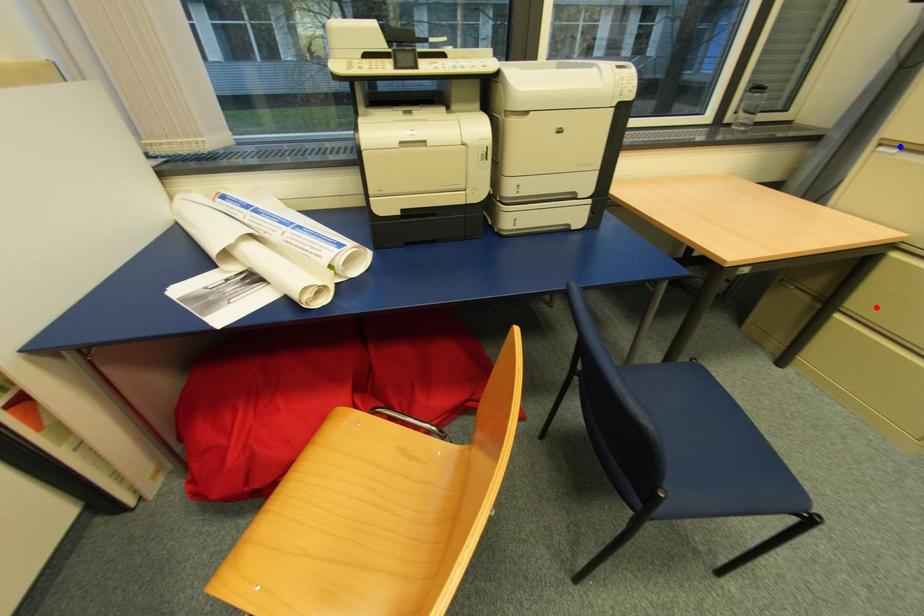
Question: Which of the two points in the image is closer to the camera?

Choices:
 (A) Blue point is closer.
 (B) Red point is closer.

Answer: (A)